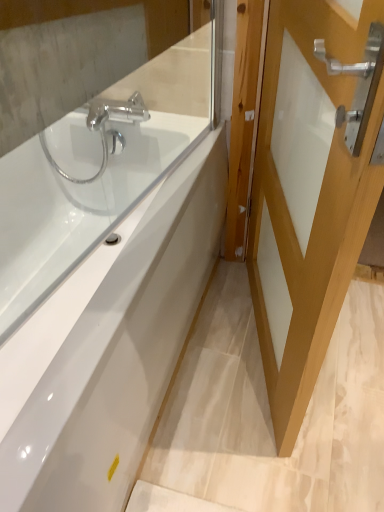
Where is `free region on the left part of white glossy door at right`? free region on the left part of white glossy door at right is located at coordinates (211, 356).